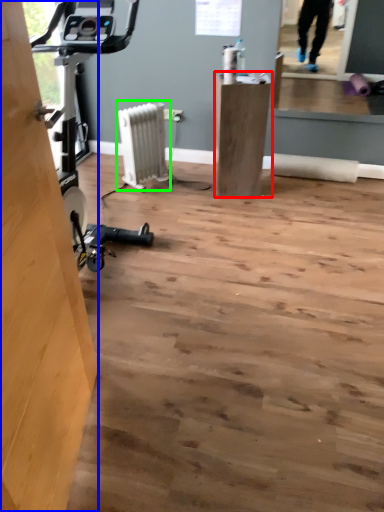
Question: Considering the real-world distances, which object is closest to furniture (highlighted by a red box)? plywood (highlighted by a blue box) or radiator (highlighted by a green box).

Choices:
 (A) plywood
 (B) radiator

Answer: (B)